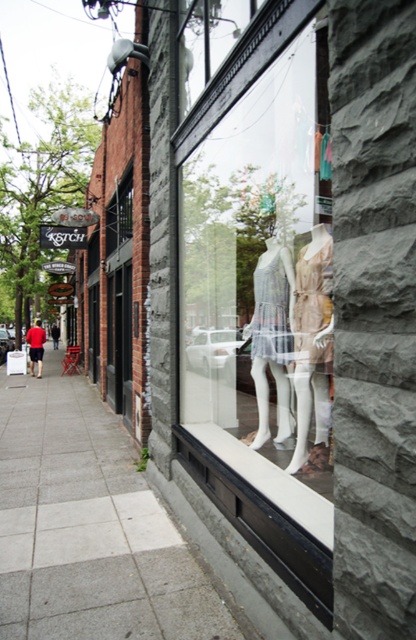
You are standing in front of the store and want to take a photo that includes both the point at (x=321, y=433) and the point at (x=32, y=355). Which point should you focus on first to ensure both are in sharp focus?

You should focus on the point at (x=32, y=355) first because it is farther from the camera compared to the point at (x=321, y=433). By focusing on the farther point, the closer point will also be within the depth of field, ensuring both are in sharp focus.

You are a window shopper standing on the sidewalk. You notice the white sheer fabric dress at center and the red shirt at left in the store window. Which item is positioned higher in the display?

The white sheer fabric dress at center is above the red shirt at left, so it is positioned higher in the display.